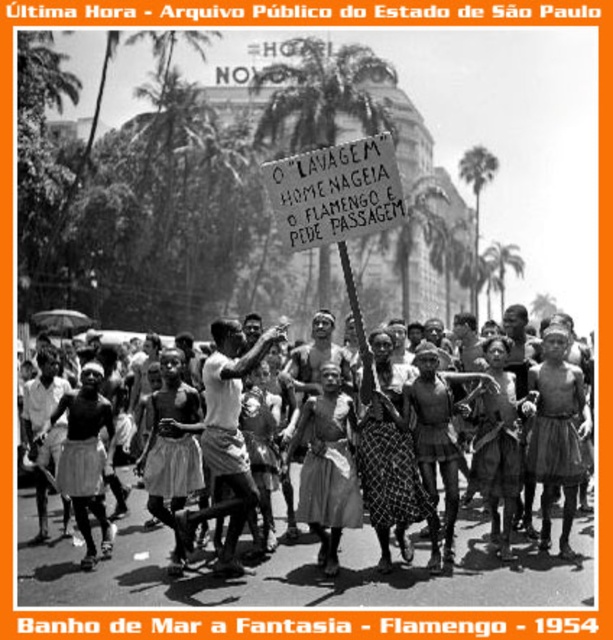
Question: Which of the following is the farthest from the observer?

Choices:
 (A) (367, 184)
 (B) (131, 540)

Answer: (B)

Question: Estimate the real-world distances between objects in this image. Which object is farther from the dark skin human at center?

Choices:
 (A) light brown fabric skirt at center
 (B) wooden signboard at center

Answer: (B)

Question: Which of the following is the closest to the observer?

Choices:
 (A) dark skin human at center
 (B) light brown fabric skirt at center

Answer: (A)

Question: Is wooden signboard at center below light brown fabric skirt at center?

Choices:
 (A) no
 (B) yes

Answer: (A)

Question: Is dark skin human at center positioned at the back of wooden signboard at center?

Choices:
 (A) no
 (B) yes

Answer: (B)

Question: Observing the image, what is the correct spatial positioning of dark skin human at center in reference to light brown fabric skirt at center?

Choices:
 (A) below
 (B) above

Answer: (A)